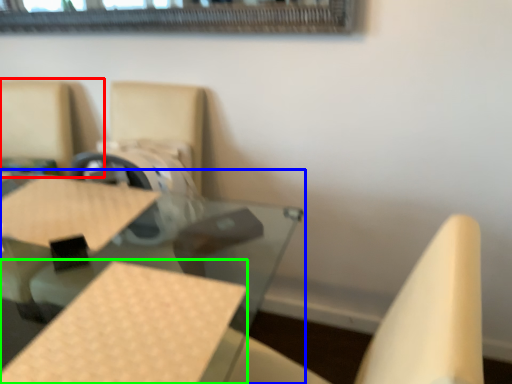
Question: Which object is the farthest from chair (highlighted by a red box)? Choose among these: table (highlighted by a blue box) or plywood (highlighted by a green box).

Choices:
 (A) table
 (B) plywood

Answer: (B)